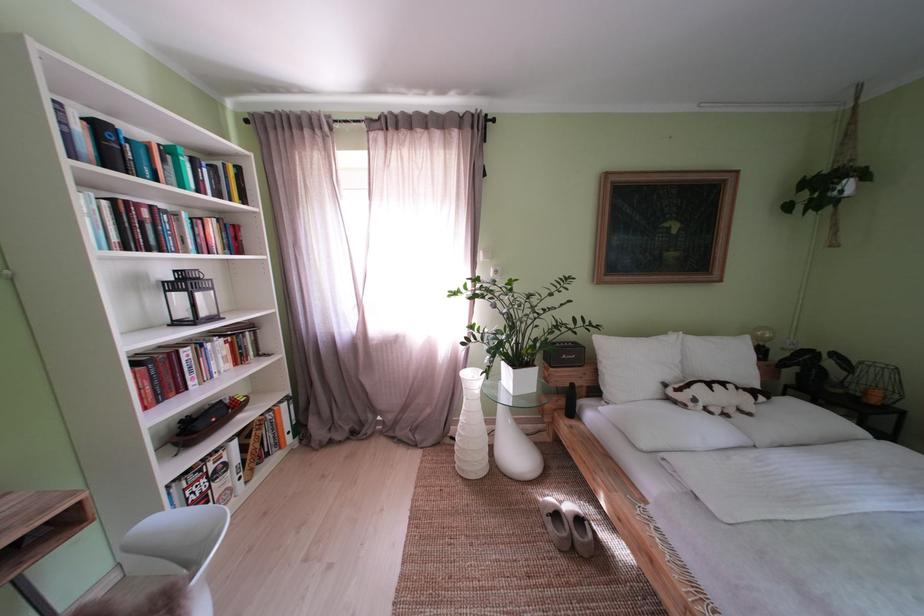
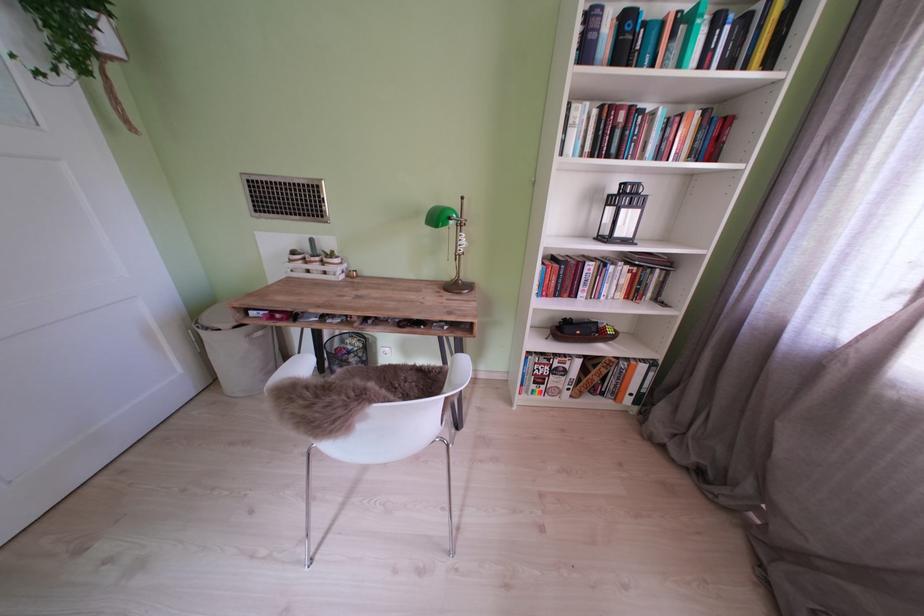
The first image is from the beginning of the video and the second image is from the end. How did the camera likely rotate when shooting the video?

The camera rotated toward left-down.